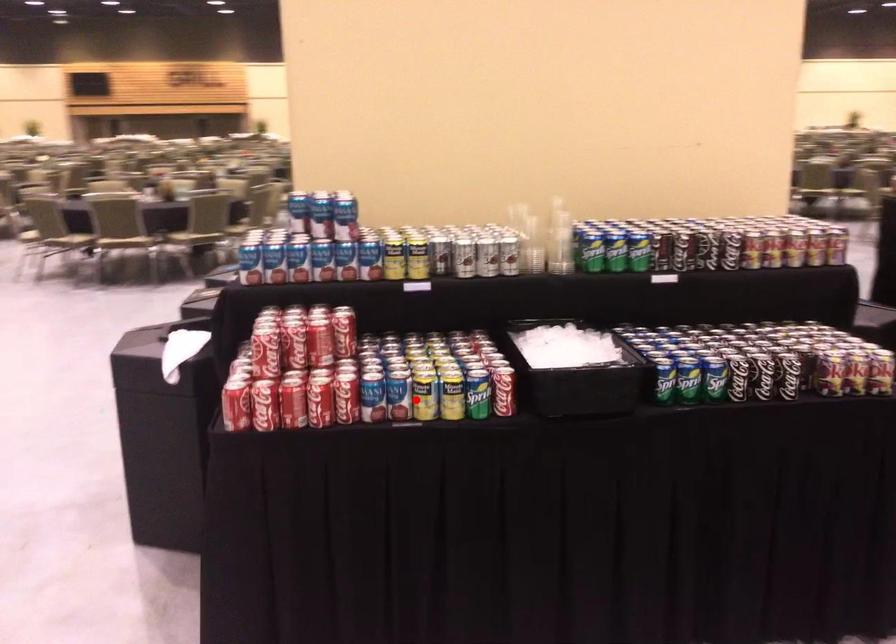
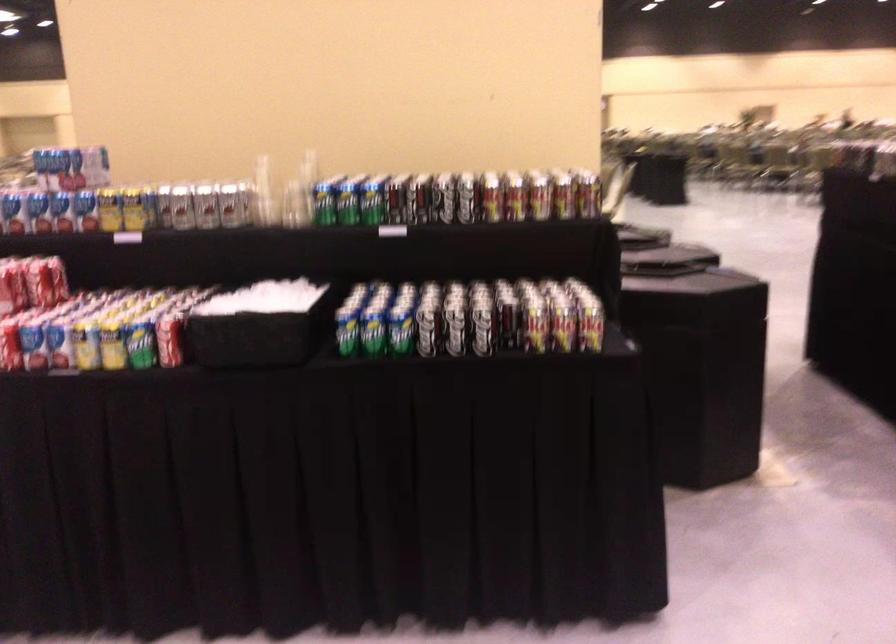
Where in the second image is the point corresponding to the highlighted location from the first image?

(84, 345)